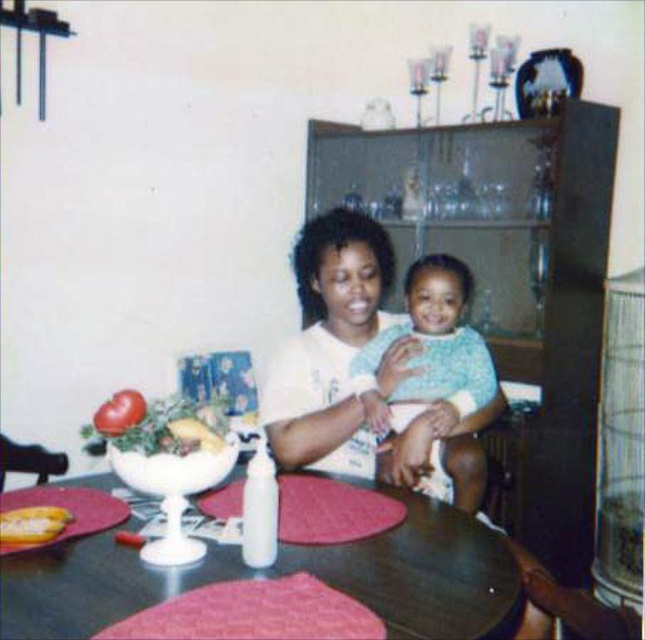
Between point (23, 592) and point (372, 460), which one is positioned in front?

Point (23, 592)

Who is higher up, dark wood table at center or white matte shirt at center?

white matte shirt at center

Does point (461, 556) lie in front of point (315, 337)?

Yes, it is.

The height and width of the screenshot is (640, 645). What are the coordinates of `dark wood table at center` in the screenshot? It's located at (281, 573).

Who is lower down, light blue knit sweater at center or smooth red tomato at left?

smooth red tomato at left

Which is more to the left, light blue knit sweater at center or smooth red tomato at left?

Positioned to the left is smooth red tomato at left.

What do you see at coordinates (428, 365) in the screenshot? I see `light blue knit sweater at center` at bounding box center [428, 365].

Locate an element on the screen. Image resolution: width=645 pixels, height=640 pixels. light blue knit sweater at center is located at coordinates (x=428, y=365).

Can you confirm if dark wood table at center is taller than yellow matte banana at lower left?

Indeed, dark wood table at center has a greater height compared to yellow matte banana at lower left.

Is point (25, 554) closer to viewer compared to point (63, 513)?

Yes, it is in front of point (63, 513).

The height and width of the screenshot is (640, 645). I want to click on dark wood table at center, so click(x=281, y=573).